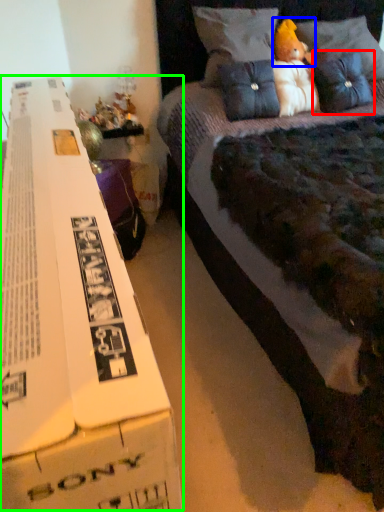
Question: Which is nearer to the pillow (highlighted by a red box)? toy (highlighted by a blue box) or paperback book (highlighted by a green box).

Choices:
 (A) toy
 (B) paperback book

Answer: (A)